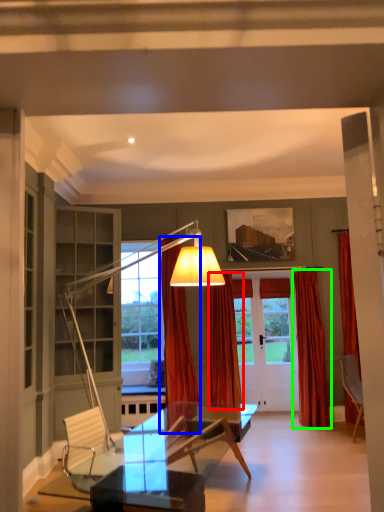
Question: Which is farther away from curtain (highlighted by a red box)? curtain (highlighted by a blue box) or curtain (highlighted by a green box)?

Choices:
 (A) curtain
 (B) curtain

Answer: (B)